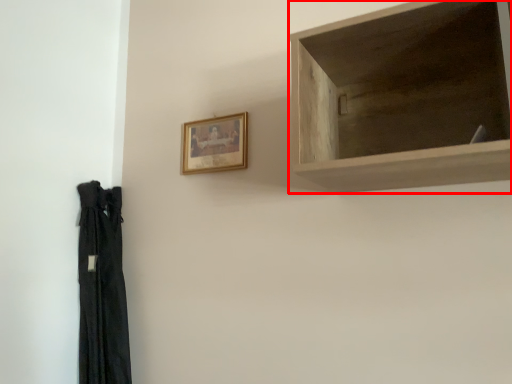
Question: From the image's perspective, considering the relative positions of shelf (annotated by the red box) and picture frame in the image provided, where is shelf (annotated by the red box) located with respect to the staircase?

Choices:
 (A) above
 (B) below

Answer: (A)